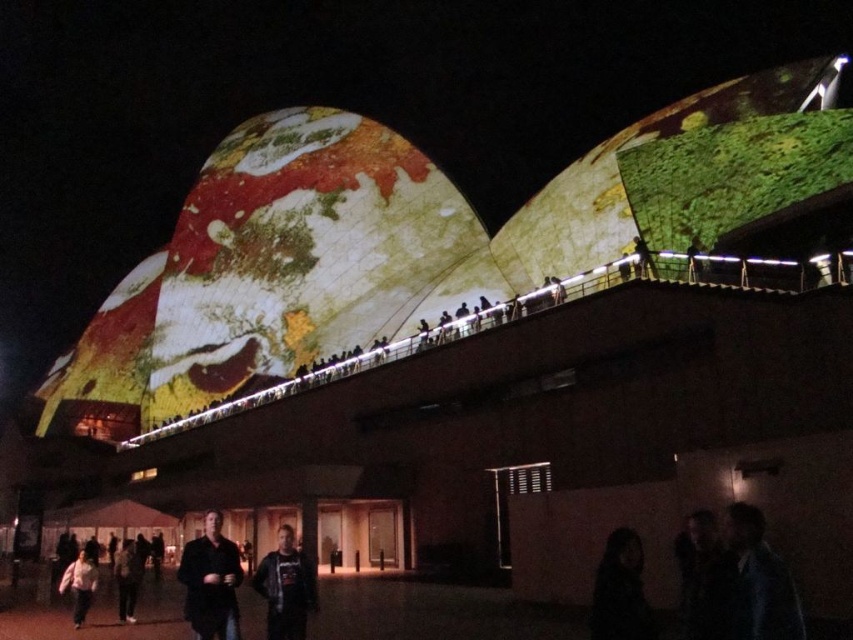
Is dark blue fabric jacket at lower right bigger than dark gray hoodie at center?

Incorrect, dark blue fabric jacket at lower right is not larger than dark gray hoodie at center.

Is dark blue fabric jacket at lower right above dark gray hoodie at center?

Indeed, dark blue fabric jacket at lower right is positioned over dark gray hoodie at center.

Does point (779, 563) come behind point (279, 595)?

That is False.

Image resolution: width=853 pixels, height=640 pixels. Identify the location of dark blue fabric jacket at lower right. (759, 580).

Is dark brown leather jacket at lower center taller than dark gray hoodie at center?

Yes.

Who is more forward, (219, 612) or (305, 557)?

Positioned in front is point (219, 612).

Locate an element on the screen. This screenshot has width=853, height=640. dark brown leather jacket at lower center is located at coordinates (212, 582).

Based on the photo, does dark brown leather jacket at lower center have a greater width compared to white matte shirt at lower left?

Yes.

Measure the distance between dark brown leather jacket at lower center and camera.

dark brown leather jacket at lower center and camera are 42.89 meters apart.

Which is behind, point (202, 611) or point (73, 579)?

Positioned behind is point (73, 579).

Find the location of `dark brown leather jacket at lower center`. dark brown leather jacket at lower center is located at coordinates (212, 582).